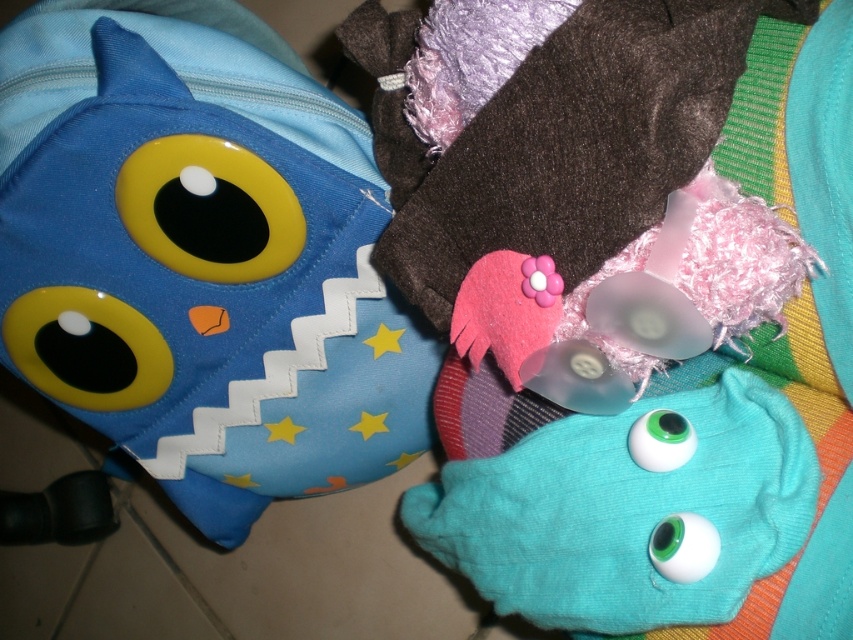
Question: Is teal fabric blanket at upper right smaller than teal fabric eyes at center?

Choices:
 (A) yes
 (B) no

Answer: (B)

Question: Among these points, which one is farthest from the camera?

Choices:
 (A) (495, 285)
 (B) (38, 305)
 (C) (776, 474)

Answer: (B)

Question: Can you confirm if matte blue plush toy at left is thinner than teal fabric eyes at center?

Choices:
 (A) yes
 (B) no

Answer: (B)

Question: Among these points, which one is farthest from the camera?

Choices:
 (A) click(x=129, y=35)
 (B) click(x=756, y=45)

Answer: (A)

Question: Which point appears farthest from the camera in this image?

Choices:
 (A) (277, 192)
 (B) (842, 550)

Answer: (A)

Question: Is matte blue plush toy at left to the right of teal fabric blanket at upper right from the viewer's perspective?

Choices:
 (A) yes
 (B) no

Answer: (B)